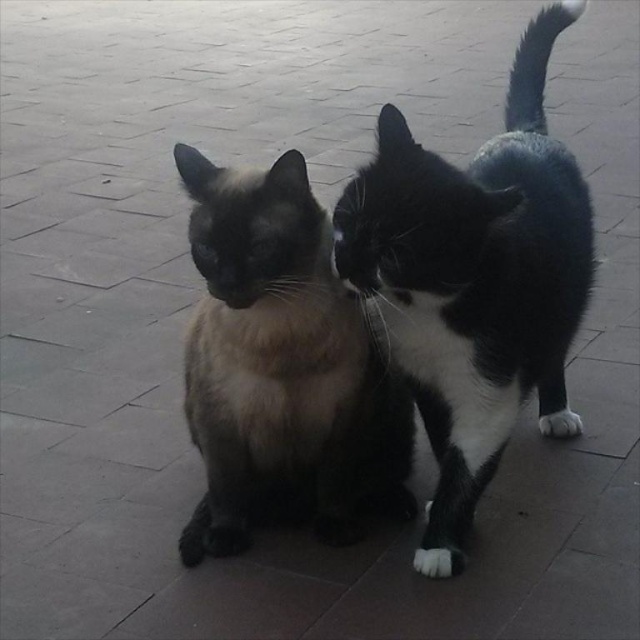
Question: Is black and white fur cat at right to the right of smokey fur cat at center from the viewer's perspective?

Choices:
 (A) yes
 (B) no

Answer: (A)

Question: Which point is closer to the camera?

Choices:
 (A) smokey fur cat at center
 (B) black and white fur cat at right

Answer: (B)

Question: Which point is closer to the camera?

Choices:
 (A) (436, 508)
 (B) (230, 305)

Answer: (B)

Question: Can you confirm if black and white fur cat at right is positioned above smokey fur cat at center?

Choices:
 (A) yes
 (B) no

Answer: (A)

Question: From the image, what is the correct spatial relationship of black and white fur cat at right in relation to smokey fur cat at center?

Choices:
 (A) above
 (B) below

Answer: (A)